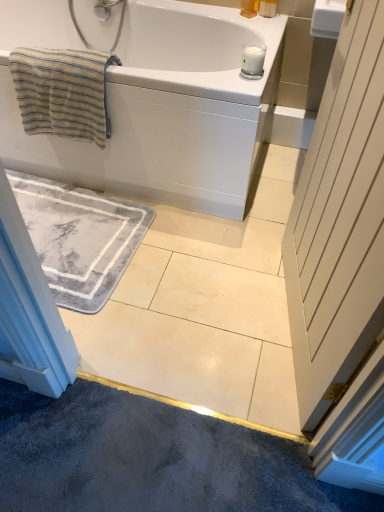
I want to click on empty space that is in between white wooden door at right and gray plush bath mat at lower left, so click(x=203, y=302).